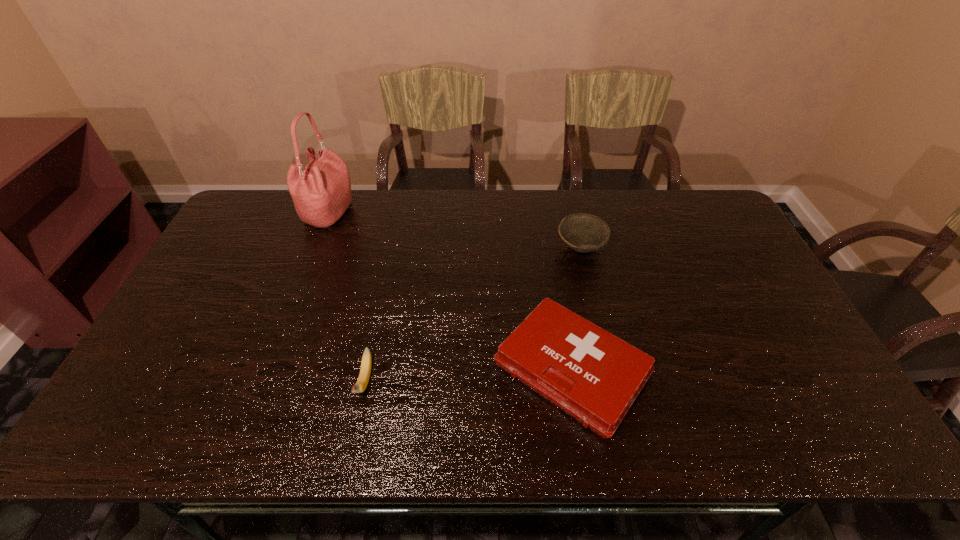
Identify the location of the tallest object. This screenshot has width=960, height=540. (321, 191).

Locate an element on the screen. The height and width of the screenshot is (540, 960). the leftmost object is located at coordinates (321, 191).

Identify the location of bowl. (582, 232).

Locate an element on the screen. the second object from left to right is located at coordinates (365, 370).

In order to click on the first-aid kit in this screenshot , I will do `click(594, 376)`.

Identify the location of vacant space located on the right of the leftmost object. (430, 214).

Find the location of a particular element. Image resolution: width=960 pixels, height=540 pixels. free space located on the left of the bowl is located at coordinates (528, 247).

In order to click on vacant region located 0.110m on the left of the shortest object in this screenshot , I will do `click(450, 368)`.

Locate an element on the screen. This screenshot has height=540, width=960. handbag that is positioned at the far edge is located at coordinates (321, 191).

Identify the location of bowl that is at the far edge. The image size is (960, 540). (582, 232).